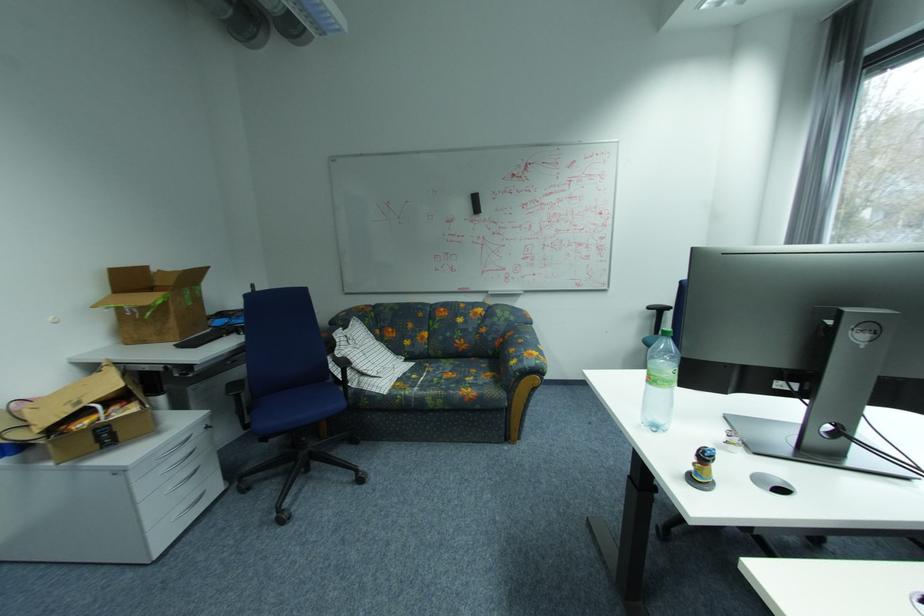
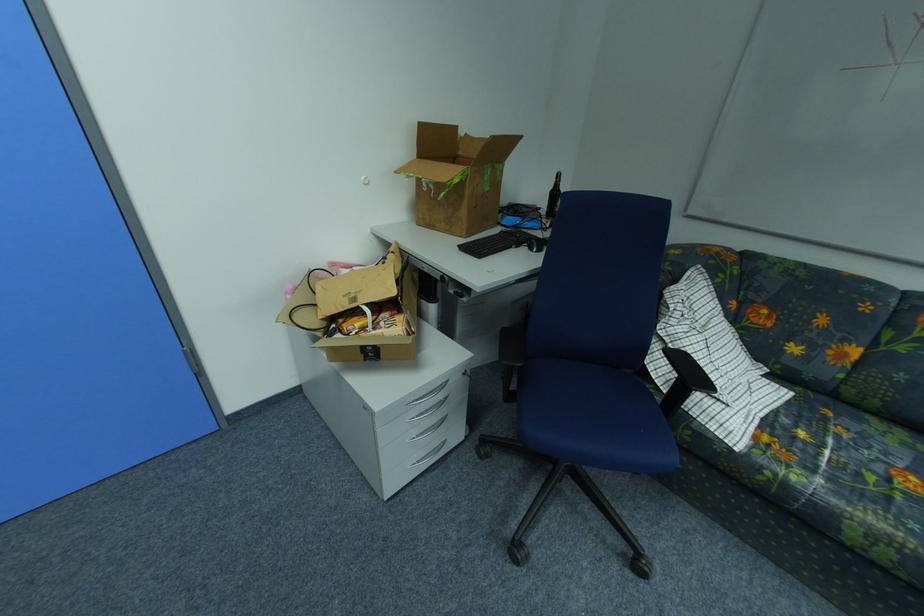
In the second image, find the point that corresponds to (248,329) in the first image.

(541, 241)